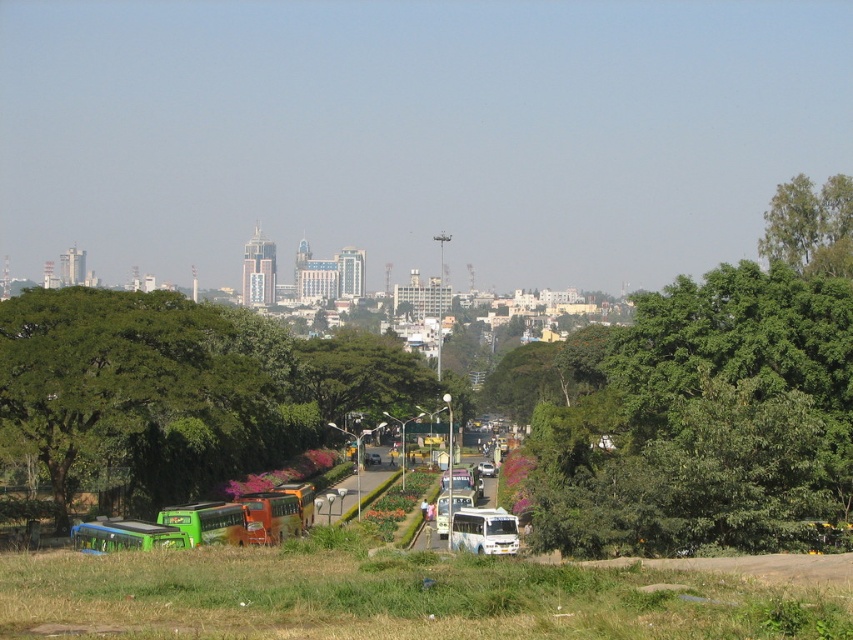
Can you confirm if green leafy tree at center is smaller than green leafy tree at upper right?

Actually, green leafy tree at center might be larger than green leafy tree at upper right.

Can you confirm if green leafy tree at center is taller than green leafy tree at upper right?

Indeed, green leafy tree at center has a greater height compared to green leafy tree at upper right.

Which is behind, point (332, 372) or point (807, 212)?

The point (332, 372) is behind.

The height and width of the screenshot is (640, 853). In order to click on green leafy tree at center in this screenshot , I will do `click(363, 376)`.